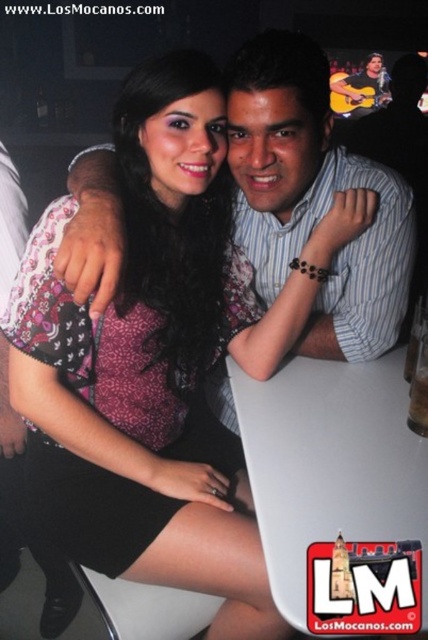
Between matte striped shirt at center and smooth brown guitar at upper right, which one appears on the right side from the viewer's perspective?

smooth brown guitar at upper right is more to the right.

Who is more distant from viewer, (265, 272) or (336, 77)?

Point (336, 77)

Image resolution: width=428 pixels, height=640 pixels. I want to click on matte striped shirt at center, so click(x=312, y=196).